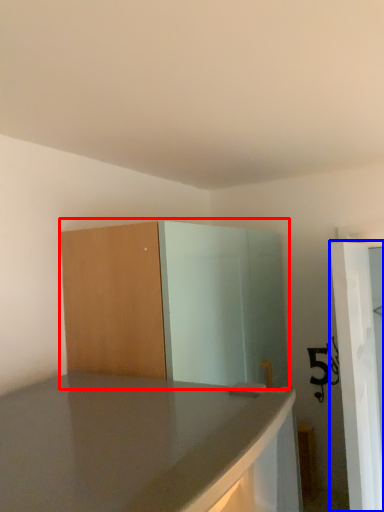
Question: Among these objects, which one is farthest to the camera, dresser (highlighted by a red box) or screen door (highlighted by a blue box)?

Choices:
 (A) dresser
 (B) screen door

Answer: (B)